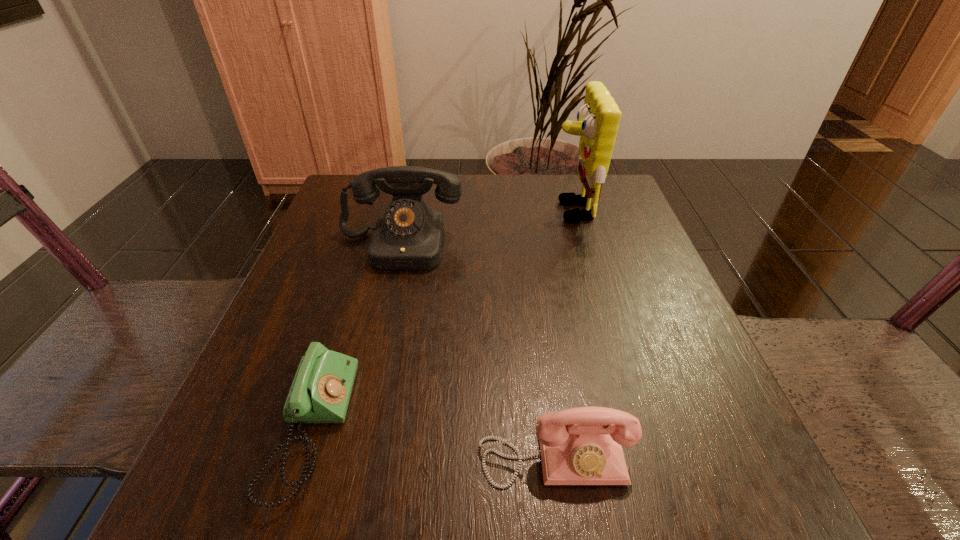
Where is `sponge`? sponge is located at coordinates (598, 119).

Where is `the third shortest object`? Image resolution: width=960 pixels, height=540 pixels. the third shortest object is located at coordinates (408, 236).

Where is `the farthest telephone`? The image size is (960, 540). the farthest telephone is located at coordinates (408, 236).

You are a GUI agent. You are given a task and a screenshot of the screen. Output one action in this format:
    pyautogui.click(x=<x>, y=<y>)
    Task: Click on the second shortest object
    The image size is (960, 540).
    Given the screenshot: What is the action you would take?
    pyautogui.click(x=579, y=446)

I want to click on the rightmost telephone, so click(x=579, y=446).

I want to click on the shortest telephone, so click(x=320, y=393).

The image size is (960, 540). I want to click on free space located 0.260m on the face of the sponge, so click(x=443, y=211).

At what (x,y) coordinates should I click in order to perform the action: click on vacant region located 0.280m on the face of the sponge. Please return your answer as a coordinate pair (x, y). The image size is (960, 540). Looking at the image, I should click on (434, 211).

Locate an element on the screen. This screenshot has width=960, height=540. vacant region located on the face of the sponge is located at coordinates (518, 211).

The width and height of the screenshot is (960, 540). Identify the location of vacant space positioned 0.400m on the dial of the farthest telephone. tap(349, 466).